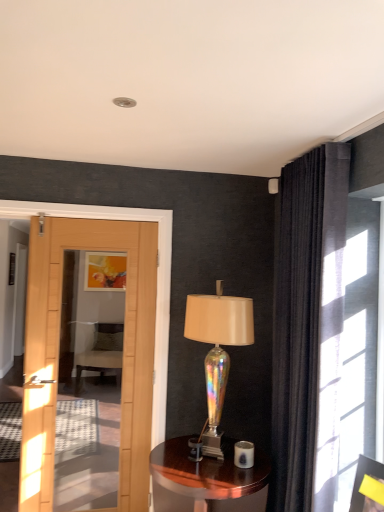
Identify the location of vacant area that lies in front of iridescent glass lamp at center. (205, 474).